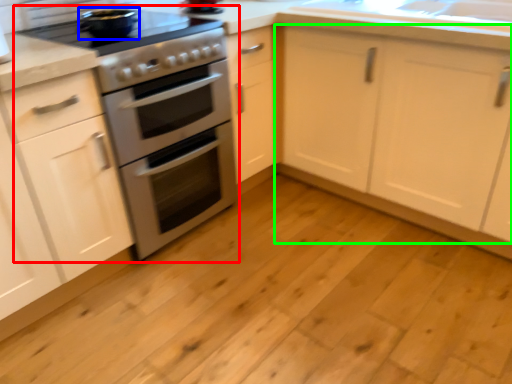
Question: Which is nearer to the appliance (highlighted by a red box)? appliance (highlighted by a blue box) or cabinetry (highlighted by a green box).

Choices:
 (A) appliance
 (B) cabinetry

Answer: (A)